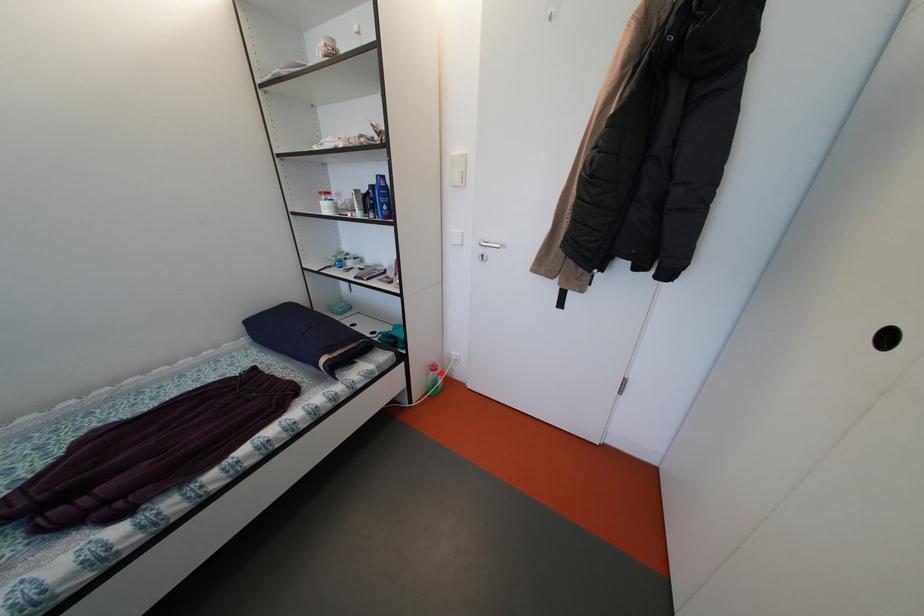
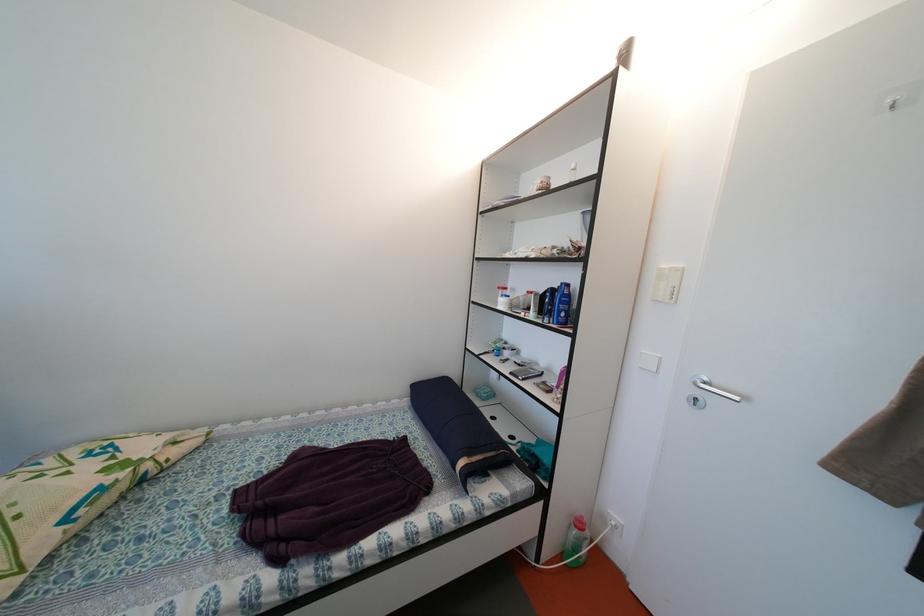
Locate, in the second image, the point that corresponds to the highlighted location in the first image.

(587, 530)